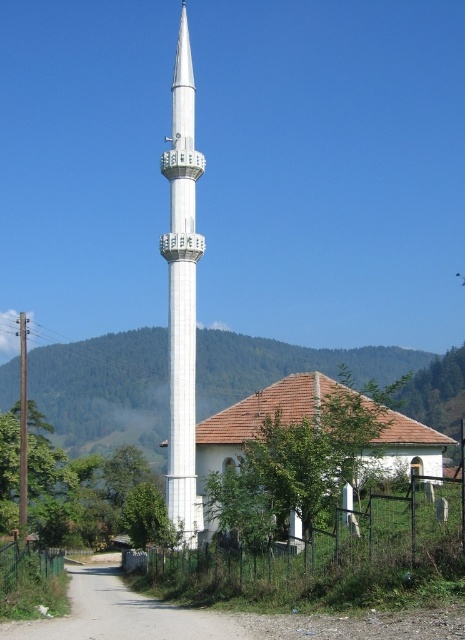
You are standing in the rural area and want to take a photo of the minaret and the mosque. You notice two points marked as point (425, 529) and point (33, 602). Which point is closer to your camera when focusing on the minaret and mosque?

Point (425, 529) is closer to the camera than point (33, 602).

You are standing in the rural area and see the white smooth minaret at center and the white tile roof at center. Which one is more to the left?

The white smooth minaret at center is more to the left because it is positioned on the left side of the white tile roof at center.